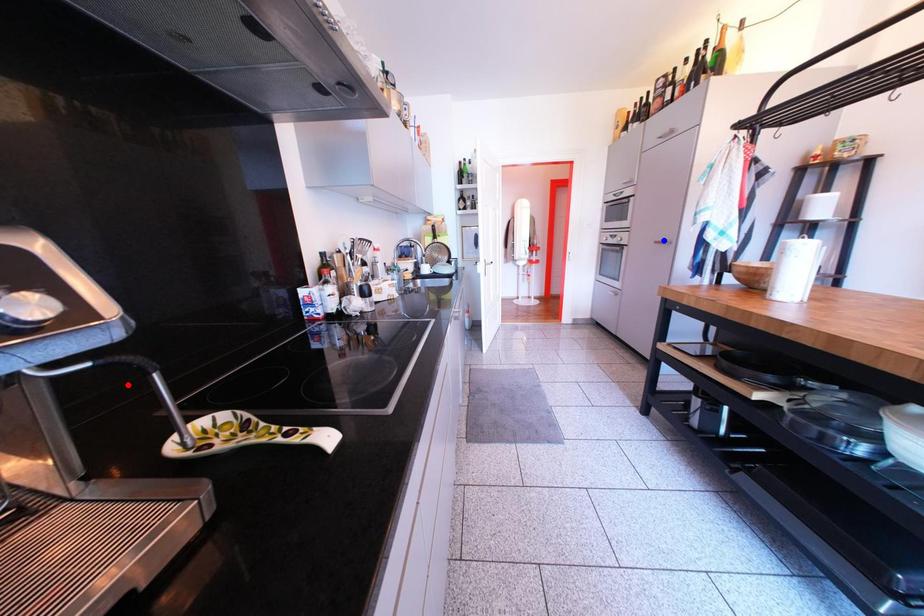
Question: Two points are marked on the image. Which point is closer to the camera?

Choices:
 (A) Blue point is closer.
 (B) Red point is closer.

Answer: (B)